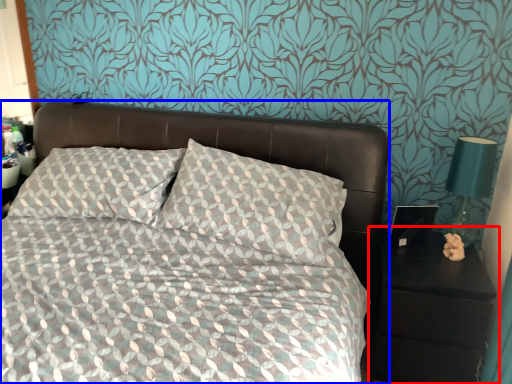
Question: Which of the following is the farthest to the observer, nightstand (highlighted by a red box) or bed (highlighted by a blue box)?

Choices:
 (A) nightstand
 (B) bed

Answer: (A)